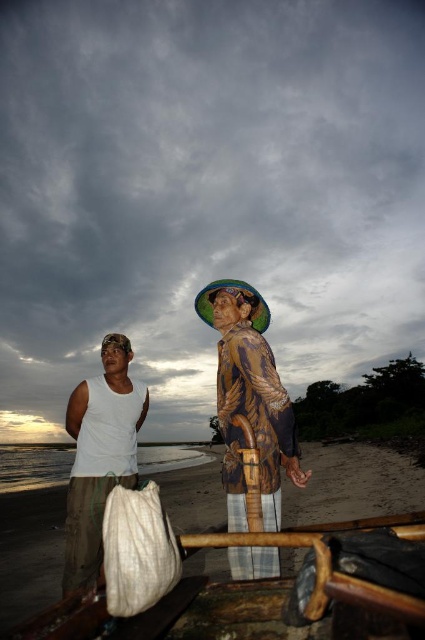
Question: Does wooden statue at center have a larger size compared to white fabric sack at lower left?

Choices:
 (A) no
 (B) yes

Answer: (B)

Question: Which point is farther from the camera taking this photo?

Choices:
 (A) (27, 532)
 (B) (144, 573)

Answer: (A)

Question: Where is brown sand at lower center located in relation to wooden statue at center in the image?

Choices:
 (A) below
 (B) above

Answer: (A)

Question: Which object appears farthest from the camera in this image?

Choices:
 (A) brown sand at lower center
 (B) white fabric sack at lower left
 (C) wooden statue at center

Answer: (A)

Question: Does brown sand at lower center come in front of white fabric sack at lower left?

Choices:
 (A) yes
 (B) no

Answer: (B)

Question: Considering the real-world distances, which object is closest to the brown sand at lower center?

Choices:
 (A) wooden statue at center
 (B) white matte tank top at center
 (C) white fabric sack at lower left

Answer: (C)